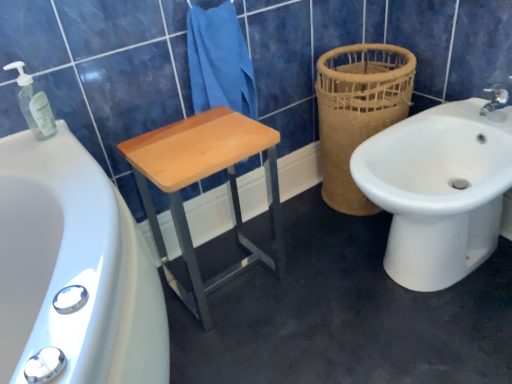
What are the coordinates of `free spot above light wood/matte stool at center (from a real-world perspective)` in the screenshot? It's located at (200, 136).